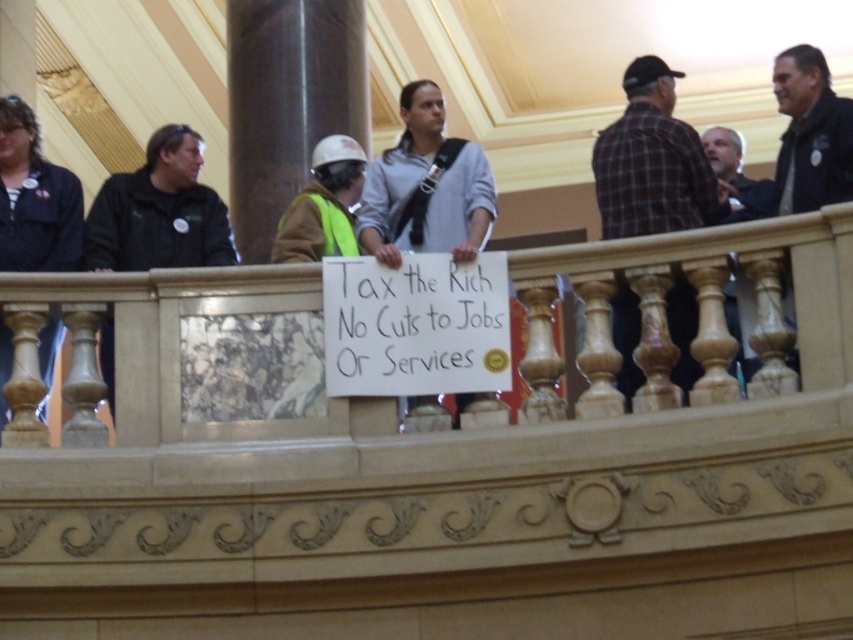
Question: Which point is farther from the camera taking this photo?

Choices:
 (A) (321, 195)
 (B) (637, 147)
 (C) (438, 124)

Answer: (C)

Question: Can you confirm if gray fabric shirt at center is smaller than hard hat at center?

Choices:
 (A) no
 (B) yes

Answer: (A)

Question: Which point appears closest to the camera in this image?

Choices:
 (A) (312, 168)
 (B) (158, 218)

Answer: (A)

Question: Among these points, which one is farthest from the camera?

Choices:
 (A) (177, 161)
 (B) (7, 256)

Answer: (A)

Question: Does gray fabric shirt at center lie in front of hard hat at center?

Choices:
 (A) yes
 (B) no

Answer: (A)

Question: Does black leather jacket at left have a greater width compared to dark blue jacket at left?

Choices:
 (A) no
 (B) yes

Answer: (B)